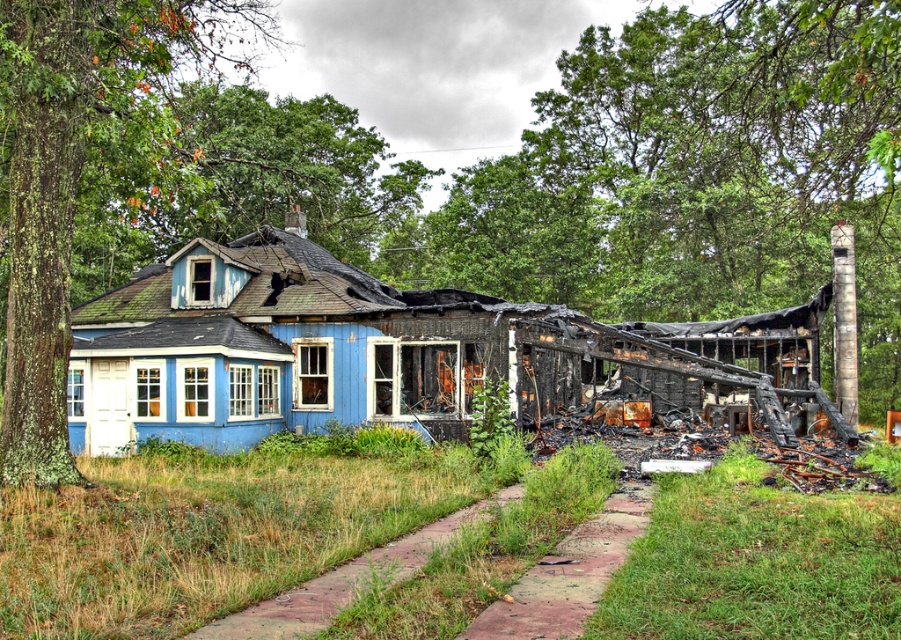
Question: Which object appears closest to the camera in this image?

Choices:
 (A) green leafy tree at upper center
 (B) green lichen-covered tree at left

Answer: (B)

Question: Can you confirm if green lichen-covered tree at left is wider than green leafy tree at upper center?

Choices:
 (A) no
 (B) yes

Answer: (B)

Question: Can you confirm if green lichen-covered tree at left is positioned below green leafy tree at upper center?

Choices:
 (A) no
 (B) yes

Answer: (A)

Question: Can you confirm if green lichen-covered tree at left is positioned above green leafy tree at upper center?

Choices:
 (A) no
 (B) yes

Answer: (B)